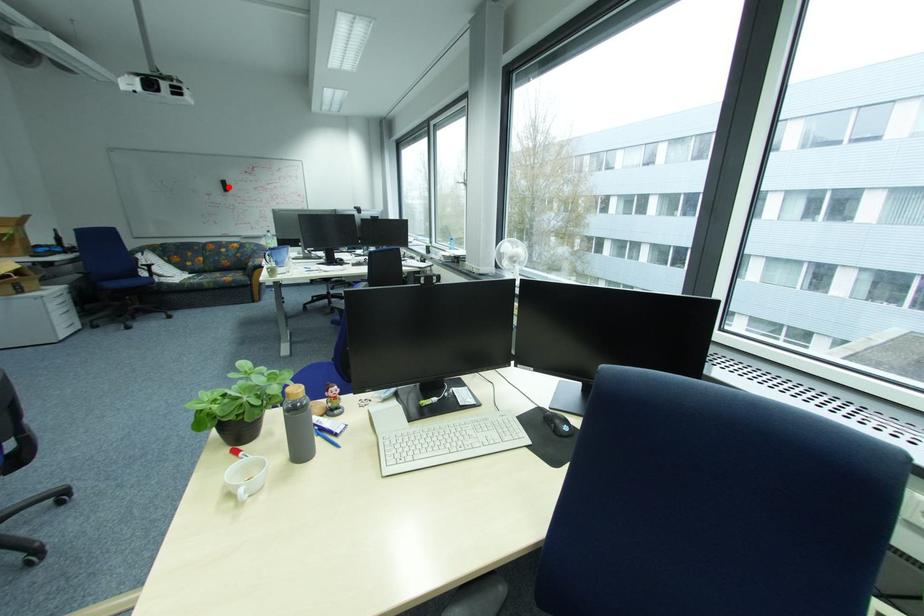
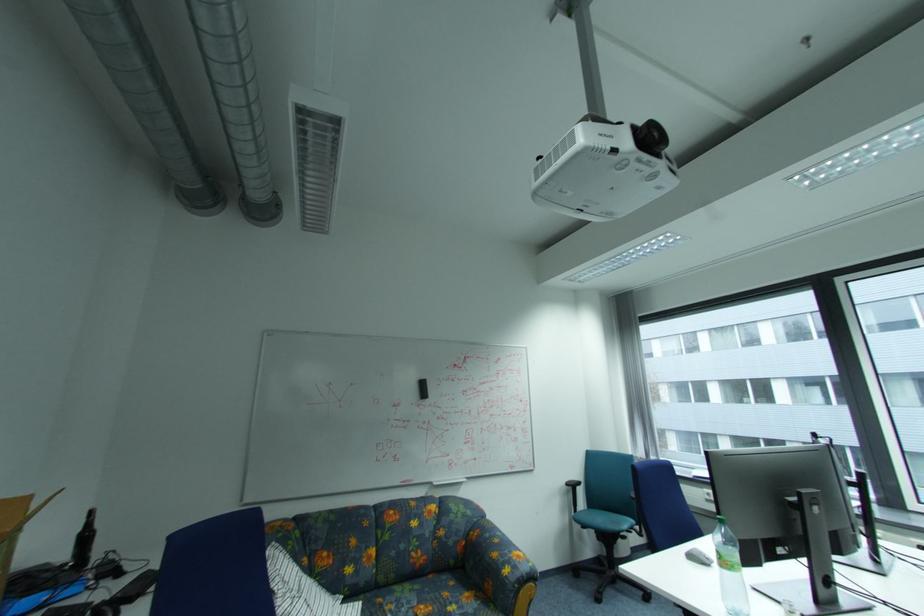
Locate, in the second image, the point that corresponds to the highlighted location in the first image.

(423, 391)